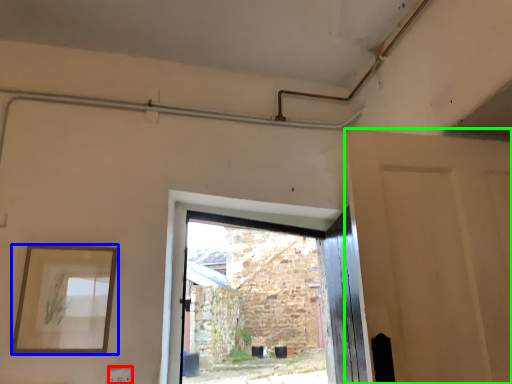
Question: Considering the real-world distances, which object is farthest from electric outlet (highlighted by a red box)? picture frame (highlighted by a blue box) or door (highlighted by a green box)?

Choices:
 (A) picture frame
 (B) door

Answer: (B)